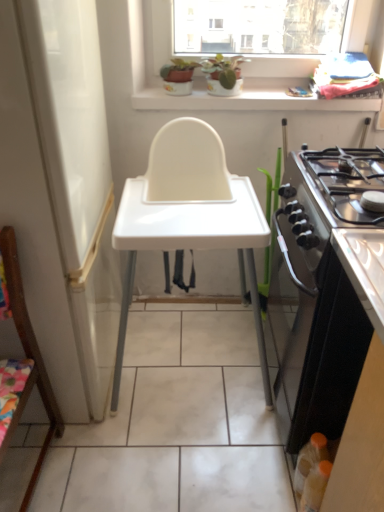
Question: Is wooden chair at left located outside black glossy oven at right?

Choices:
 (A) yes
 (B) no

Answer: (A)

Question: Can you confirm if wooden chair at left is positioned to the right of black glossy oven at right?

Choices:
 (A) no
 (B) yes

Answer: (A)

Question: Can you confirm if wooden chair at left is shorter than black glossy oven at right?

Choices:
 (A) no
 (B) yes

Answer: (A)

Question: Can you confirm if wooden chair at left is smaller than black glossy oven at right?

Choices:
 (A) yes
 (B) no

Answer: (A)

Question: From a real-world perspective, is wooden chair at left physically above black glossy oven at right?

Choices:
 (A) no
 (B) yes

Answer: (B)

Question: From the image's perspective, is stainless steel gas stove at right above or below black glossy oven at right?

Choices:
 (A) above
 (B) below

Answer: (A)

Question: Considering the positions of point (354, 169) and point (289, 416), is point (354, 169) closer or farther from the camera than point (289, 416)?

Choices:
 (A) closer
 (B) farther

Answer: (A)

Question: From their relative heights in the image, would you say stainless steel gas stove at right is taller or shorter than black glossy oven at right?

Choices:
 (A) tall
 (B) short

Answer: (B)

Question: From a real-world perspective, is stainless steel gas stove at right above or below black glossy oven at right?

Choices:
 (A) below
 (B) above

Answer: (B)

Question: Based on their sizes in the image, would you say black glossy oven at right is bigger or smaller than stainless steel gas stove at right?

Choices:
 (A) big
 (B) small

Answer: (A)

Question: Is black glossy oven at right inside the boundaries of stainless steel gas stove at right, or outside?

Choices:
 (A) inside
 (B) outside

Answer: (B)

Question: In terms of height, does black glossy oven at right look taller or shorter compared to stainless steel gas stove at right?

Choices:
 (A) short
 (B) tall

Answer: (B)

Question: From a real-world perspective, is black glossy oven at right physically located above or below stainless steel gas stove at right?

Choices:
 (A) below
 (B) above

Answer: (A)

Question: Looking at their shapes, would you say white glossy window sill at upper center is wider or thinner than black glossy oven at right?

Choices:
 (A) thin
 (B) wide

Answer: (A)

Question: From the image's perspective, is white glossy window sill at upper center located above or below black glossy oven at right?

Choices:
 (A) below
 (B) above

Answer: (B)